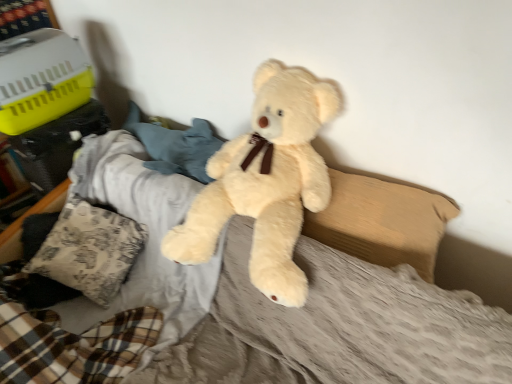
Question: Considering their positions, is patterned fabric pillow at lower left, marked as the 1th pillow in a left-to-right arrangement, located in front of or behind fluffy beige teddy bear at center?

Choices:
 (A) behind
 (B) front

Answer: (A)

Question: From a real-world perspective, relative to fluffy beige teddy bear at center, is patterned fabric pillow at lower left, which is the second pillow from right to left, vertically above or below?

Choices:
 (A) above
 (B) below

Answer: (B)

Question: Which object is positioned farthest from the fluffy beige teddy bear at center?

Choices:
 (A) patterned fabric pillow at lower left, which is the second pillow from right to left
 (B) beige fabric pillow at center, placed as the 2th pillow when sorted from left to right

Answer: (A)

Question: Based on their relative distances, which object is nearer to the patterned fabric pillow at lower left, which is the second pillow from right to left?

Choices:
 (A) fluffy beige teddy bear at center
 (B) beige fabric pillow at center, placed as the 2th pillow when sorted from left to right

Answer: (A)